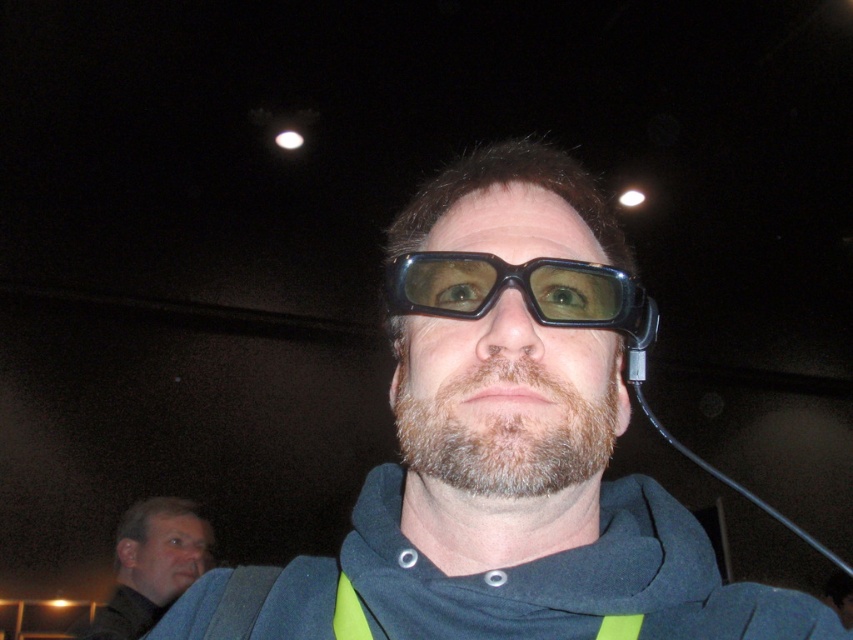
You are a theater technician checking the 3D equipment. You notice the black plastic goggles at center and the matte black glasses at lower left. Which of these two items has a shorter height?

The black plastic goggles at center is shorter than the matte black glasses at lower left.

What are the coordinates of the black plastic glasses at center?

The black plastic glasses at center are located at coordinates point (x=515, y=444).